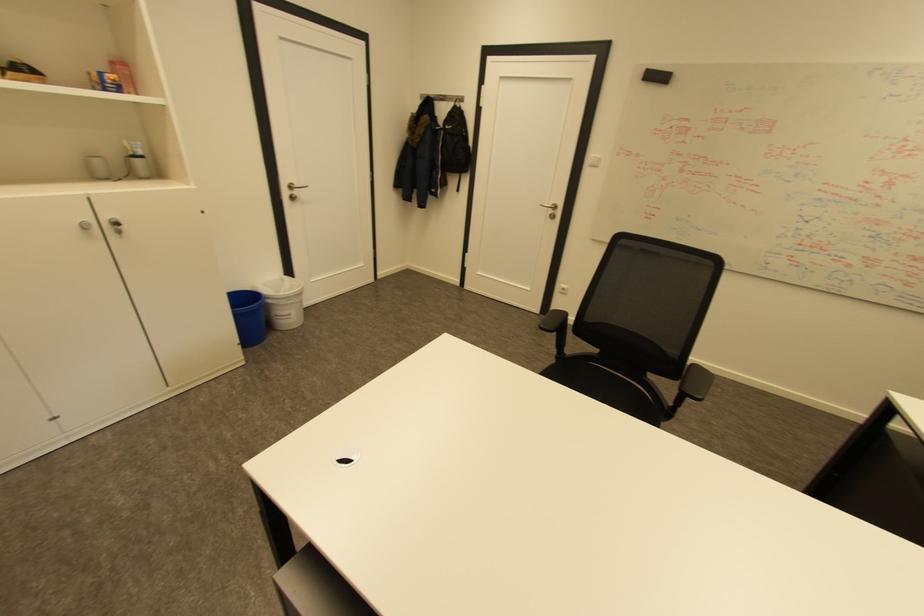
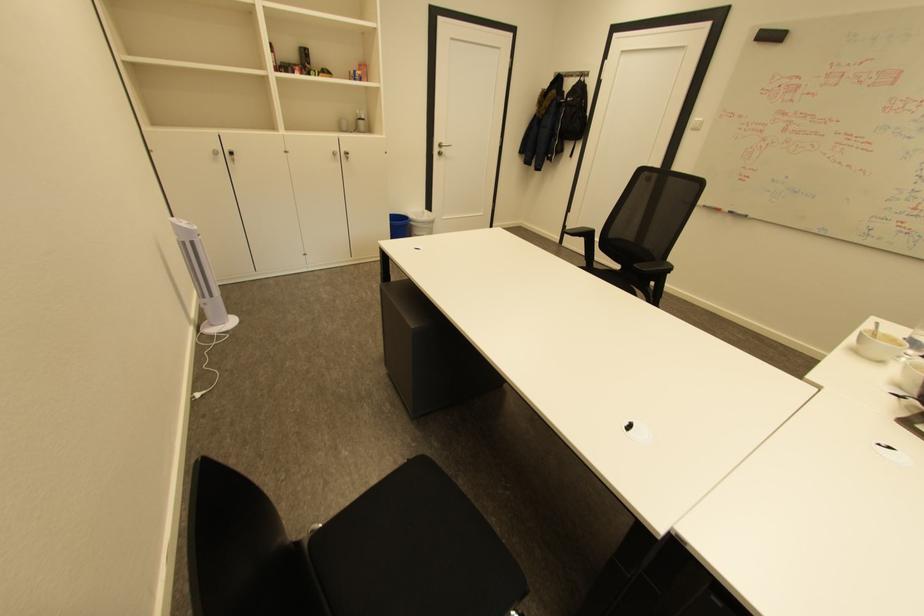
In the second image, find the point that corresponds to (x=298, y=187) in the first image.

(446, 146)